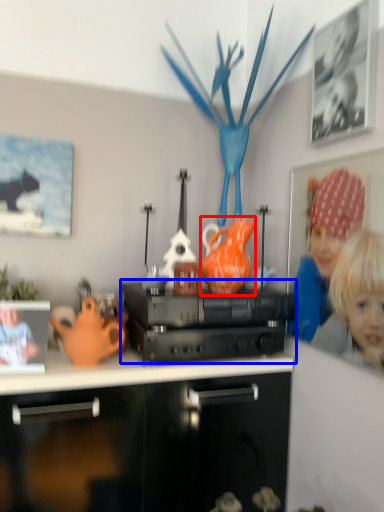
Question: Which of the following is the closest to the observer, tea pot (highlighted by a red box) or appliance (highlighted by a blue box)?

Choices:
 (A) tea pot
 (B) appliance

Answer: (B)